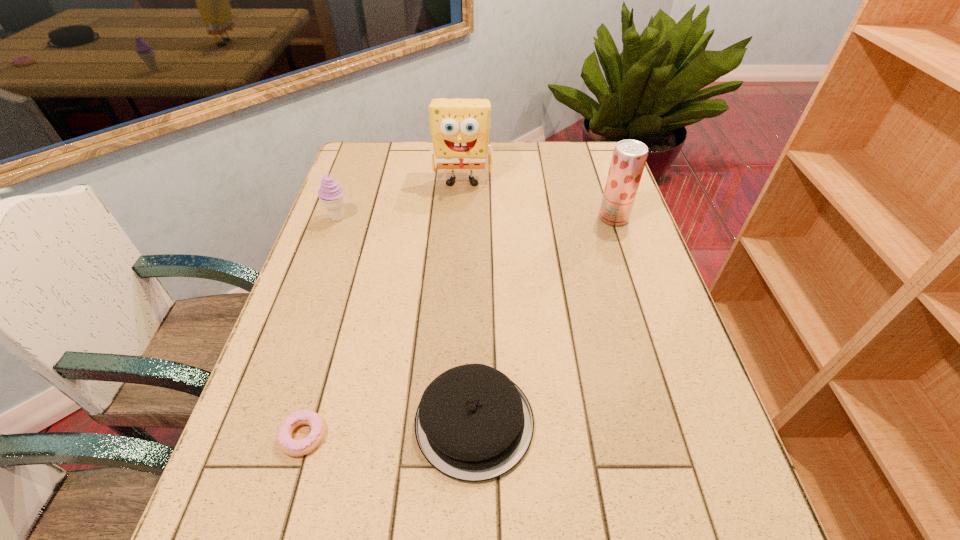
Where is `the farthest object`? the farthest object is located at coordinates (459, 128).

You are a GUI agent. You are given a task and a screenshot of the screen. Output one action in this format:
    pyautogui.click(x=<x>, y=<y>)
    Task: Click on the rightmost object
    
    Given the screenshot: What is the action you would take?
    click(x=629, y=157)

Find the location of a particular element. the third shortest object is located at coordinates (330, 193).

At what (x,y) coordinates should I click in order to perform the action: click on the leftmost object. Please return your answer as a coordinate pair (x, y). Looking at the image, I should click on (330, 193).

The height and width of the screenshot is (540, 960). I want to click on the fourth tallest object, so click(x=473, y=423).

Image resolution: width=960 pixels, height=540 pixels. I want to click on the second object from left to right, so (291, 447).

This screenshot has height=540, width=960. Identify the location of the shortest object. pyautogui.click(x=291, y=447).

Find the location of a particular element. This screenshot has width=960, height=540. vacant space situated on the face of the farthest object is located at coordinates (460, 236).

I want to click on free location located 0.330m on the back of the rightmost object, so click(x=591, y=152).

Find the location of a particular element. Image resolution: width=960 pixels, height=540 pixels. vacant space located on the right of the leftmost object is located at coordinates (453, 218).